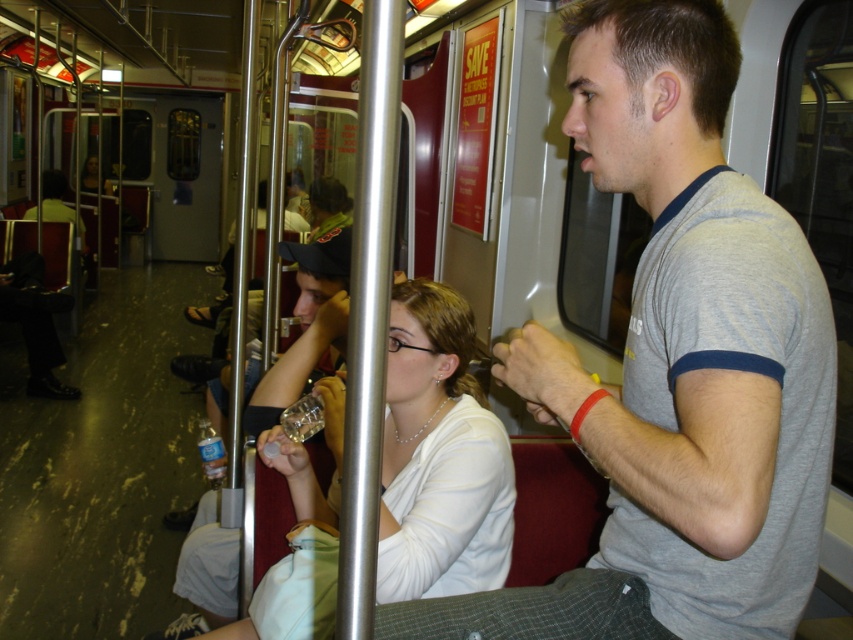
Question: Which point is closer to the camera?

Choices:
 (A) translucent plastic bottle at lower left
 (B) white matte shirt at center

Answer: (B)

Question: Is white matte shirt at center smaller than translucent plastic bottle at lower left?

Choices:
 (A) yes
 (B) no

Answer: (B)

Question: Does white matte shirt at center appear under translucent plastic bottle at lower left?

Choices:
 (A) yes
 (B) no

Answer: (B)

Question: Does white matte shirt at center have a greater width compared to translucent plastic bottle at lower left?

Choices:
 (A) yes
 (B) no

Answer: (A)